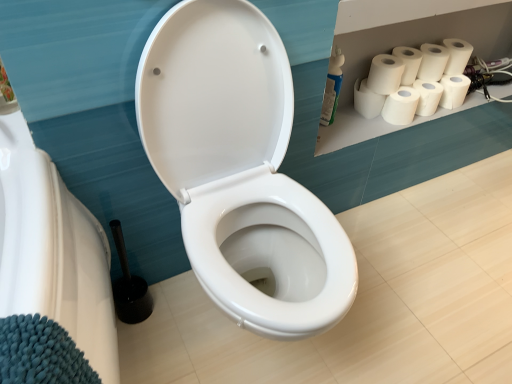
Question: Looking at their shapes, would you say white matte toilet paper at upper right, placed as the 1th toilet paper when sorted from bottom to top, is wider or thinner than white matte paper towel at upper right, acting as the first paper towel starting from the left?

Choices:
 (A) wide
 (B) thin

Answer: (B)

Question: From a real-world perspective, relative to white matte paper towel at upper right, acting as the first paper towel starting from the left, is white matte toilet paper at upper right, placed as the 1th toilet paper when sorted from bottom to top, vertically above or below?

Choices:
 (A) above
 (B) below

Answer: (A)

Question: Which of these objects is positioned farthest from the white matte paper towel at upper right, acting as the first paper towel starting from the left?

Choices:
 (A) white matte paper towel at upper right, placed as the fifth paper towel when sorted from left to right
 (B) white glossy toilet at center
 (C) white matte toilet paper rolls at upper right
 (D) white matte paper towel at upper right, the third paper towel viewed from the left
 (E) white matte paper towel at upper right, arranged as the first paper towel when viewed from the right

Answer: (B)

Question: Estimate the real-world distances between objects in this image. Which object is closer to the white matte paper towel at upper right, arranged as the first paper towel when viewed from the right?

Choices:
 (A) white matte toilet paper at upper right, placed as the 1th toilet paper when sorted from bottom to top
 (B) white matte paper towel at upper right, marked as the fifth paper towel in a right-to-left arrangement
 (C) white glossy toilet at center
 (D) white matte paper towel at upper right, the third paper towel viewed from the right
 (E) white matte paper towel at upper right, the second paper towel from the right

Answer: (D)